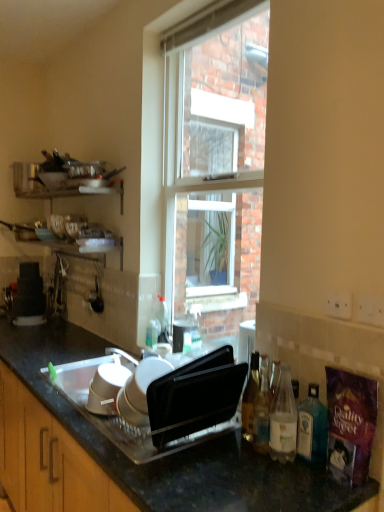
What do you see at coordinates (29, 296) in the screenshot? The height and width of the screenshot is (512, 384). I see `matte black toaster at left, the first appliance viewed from the left` at bounding box center [29, 296].

What is the approximate height of clear glass window at center?

It is 1.61 meters.

The image size is (384, 512). Describe the element at coordinates (283, 420) in the screenshot. I see `translucent glass bottle at lower right, acting as the third bottle starting from the left` at that location.

Identify the location of black granite countertop at center. The image size is (384, 512). (175, 453).

Describe the element at coordinates (262, 413) in the screenshot. I see `translucent glass bottle at lower right, acting as the second bottle starting from the left` at that location.

Looking at this image, how much space does translucent glass bottle at right, marked as the first bottle in a left-to-right arrangement, occupy horizontally?

9.78 centimeters.

What are the coordinates of `matte black toaster at left, which is the 2th appliance in bottom-to-top order` in the screenshot? It's located at (29, 296).

Which is in front, point (107, 382) or point (32, 336)?

The point (107, 382) is closer.

Is white plastic cups at lower left, positioned as the 2th appliance in back-to-front order, surrounding black granite countertop at center?

That's incorrect, black granite countertop at center is not inside white plastic cups at lower left, positioned as the 2th appliance in back-to-front order.

Are white plastic cups at lower left, arranged as the second appliance when viewed from the top, and black granite countertop at center making contact?

No, white plastic cups at lower left, arranged as the second appliance when viewed from the top, is not next to black granite countertop at center.

From a real-world perspective, is white plastic cups at lower left, the first appliance from the front, located beneath black granite countertop at center?

No, from a real-world perspective, white plastic cups at lower left, the first appliance from the front, is not below black granite countertop at center.

Is matte black toaster at left, the 1th appliance positioned from the back, smaller than white plastic cups at lower left, the first appliance from the front?

No.

From the picture: Can you confirm if matte black toaster at left, positioned as the 2th appliance in right-to-left order, is thinner than white plastic cups at lower left, the first appliance from the front?

In fact, matte black toaster at left, positioned as the 2th appliance in right-to-left order, might be wider than white plastic cups at lower left, the first appliance from the front.

Considering the relative sizes of matte black toaster at left, positioned as the 2th appliance in right-to-left order, and white plastic cups at lower left, the 1th appliance in the bottom-to-top sequence, in the image provided, is matte black toaster at left, positioned as the 2th appliance in right-to-left order, taller than white plastic cups at lower left, the 1th appliance in the bottom-to-top sequence,?

Yes, matte black toaster at left, positioned as the 2th appliance in right-to-left order, is taller than white plastic cups at lower left, the 1th appliance in the bottom-to-top sequence.

Is translucent glass bottle at right, positioned as the fourth bottle in right-to-left order, to the left of white plastic cups at lower left, which appears as the first appliance when viewed from the right, from the viewer's perspective?

Incorrect, translucent glass bottle at right, positioned as the fourth bottle in right-to-left order, is not on the left side of white plastic cups at lower left, which appears as the first appliance when viewed from the right.

Is translucent glass bottle at right, marked as the first bottle in a left-to-right arrangement, spatially inside white plastic cups at lower left, positioned as the 2th appliance in back-to-front order, or outside of it?

translucent glass bottle at right, marked as the first bottle in a left-to-right arrangement, exists outside the volume of white plastic cups at lower left, positioned as the 2th appliance in back-to-front order.

Are translucent glass bottle at right, marked as the first bottle in a left-to-right arrangement, and white plastic cups at lower left, the 1th appliance in the bottom-to-top sequence, far apart?

translucent glass bottle at right, marked as the first bottle in a left-to-right arrangement, is near white plastic cups at lower left, the 1th appliance in the bottom-to-top sequence, not far away.

How many degrees apart are the facing directions of translucent glass bottle at right, positioned as the fourth bottle in right-to-left order, and white plastic cups at lower left, arranged as the second appliance when viewed from the top?

There is a 5.94-degree angle between the facing directions of translucent glass bottle at right, positioned as the fourth bottle in right-to-left order, and white plastic cups at lower left, arranged as the second appliance when viewed from the top.

From a real-world perspective, is white plastic cups at lower left, positioned as the 2th appliance in back-to-front order, on translucent glass bottle at lower right, positioned as the 2th bottle in right-to-left order?

Actually, white plastic cups at lower left, positioned as the 2th appliance in back-to-front order, is physically below translucent glass bottle at lower right, positioned as the 2th bottle in right-to-left order, in the real world.

Are white plastic cups at lower left, the 2th appliance in the left-to-right sequence, and translucent glass bottle at lower right, acting as the third bottle starting from the left, far apart?

No, there isn't a large distance between white plastic cups at lower left, the 2th appliance in the left-to-right sequence, and translucent glass bottle at lower right, acting as the third bottle starting from the left.

From the image's perspective, is white plastic cups at lower left, positioned as the 2th appliance in back-to-front order, located above or below translucent glass bottle at lower right, positioned as the 2th bottle in right-to-left order?

white plastic cups at lower left, positioned as the 2th appliance in back-to-front order, is situated lower than translucent glass bottle at lower right, positioned as the 2th bottle in right-to-left order, in the image.

Could you tell me if white plastic cups at lower left, the 2th appliance in the left-to-right sequence, is facing translucent glass bottle at lower right, acting as the third bottle starting from the left?

No, white plastic cups at lower left, the 2th appliance in the left-to-right sequence, is not turned towards translucent glass bottle at lower right, acting as the third bottle starting from the left.

At what (x,y) coordinates should I click in order to perform the action: click on the 2nd bottle above when counting from the translucent glass bottle at lower right, which is counted as the 3th bottle, starting from the right (from the image's perspective). Please return your answer as a coordinate pair (x, y). The height and width of the screenshot is (512, 384). Looking at the image, I should click on (250, 398).

How distant is translucent glass bottle at right, positioned as the fourth bottle in right-to-left order, from translucent glass bottle at lower right, acting as the second bottle starting from the left?

They are 4.17 centimeters apart.

Looking at this image, between translucent glass bottle at right, marked as the first bottle in a left-to-right arrangement, and translucent glass bottle at lower right, acting as the second bottle starting from the left, which one has smaller width?

With smaller width is translucent glass bottle at lower right, acting as the second bottle starting from the left.

Is translucent glass bottle at right, positioned as the fourth bottle in right-to-left order, smaller than translucent glass bottle at lower right, acting as the second bottle starting from the left?

No, translucent glass bottle at right, positioned as the fourth bottle in right-to-left order, is not smaller than translucent glass bottle at lower right, acting as the second bottle starting from the left.

Consider the image. Can you confirm if matte black toaster at left, the 1th appliance positioned from the back, is smaller than black granite countertop at center?

Indeed, matte black toaster at left, the 1th appliance positioned from the back, has a smaller size compared to black granite countertop at center.

Is matte black toaster at left, the first appliance viewed from the left, surrounding black granite countertop at center?

No, matte black toaster at left, the first appliance viewed from the left, does not contain black granite countertop at center.

Does point (21, 276) come closer to viewer compared to point (120, 485)?

That is False.

At what (x,y) coordinates should I click in order to perform the action: click on countertop below the matte black toaster at left, positioned as the 2th appliance in right-to-left order (from the image's perspective). Please return your answer as a coordinate pair (x, y). This screenshot has width=384, height=512. Looking at the image, I should click on (175, 453).

From a real-world perspective, is translucent glass bottle at right, marked as the first bottle in a left-to-right arrangement, above or below translucent glass bottle at right, the 4th bottle positioned from the left?

From a real-world perspective, translucent glass bottle at right, marked as the first bottle in a left-to-right arrangement, is physically above translucent glass bottle at right, the 4th bottle positioned from the left.

Is translucent glass bottle at right, the 4th bottle positioned from the left, located within translucent glass bottle at right, marked as the first bottle in a left-to-right arrangement?

No, translucent glass bottle at right, the 4th bottle positioned from the left, is located outside of translucent glass bottle at right, marked as the first bottle in a left-to-right arrangement.

Is translucent glass bottle at right, marked as the first bottle in a left-to-right arrangement, at the right side of translucent glass bottle at right, the 4th bottle positioned from the left?

No.

Image resolution: width=384 pixels, height=512 pixels. What are the coordinates of `the 1st appliance above the black granite countertop at center (from a real-world perspective)` in the screenshot? It's located at (106, 388).

Image resolution: width=384 pixels, height=512 pixels. I want to click on appliance that appears behind the white plastic cups at lower left, positioned as the 2th appliance in back-to-front order, so tap(29, 296).

Based on their spatial positions, is clear glass window at center or matte black toaster at left, the 1th appliance positioned from the back, further from translucent glass bottle at lower right, acting as the second bottle starting from the left?

clear glass window at center lies further to translucent glass bottle at lower right, acting as the second bottle starting from the left, than the other object.

Based on their spatial positions, is translucent glass bottle at lower right, acting as the third bottle starting from the left, or translucent glass bottle at lower right, acting as the second bottle starting from the left, closer to white plastic cups at lower left, positioned as the 2th appliance in back-to-front order?

Based on the image, translucent glass bottle at lower right, acting as the second bottle starting from the left, appears to be nearer to white plastic cups at lower left, positioned as the 2th appliance in back-to-front order.

Based on their spatial positions, is clear glass window at center or translucent glass bottle at lower right, acting as the third bottle starting from the left, closer to white plastic cups at lower left, arranged as the second appliance when viewed from the top?

The object closer to white plastic cups at lower left, arranged as the second appliance when viewed from the top, is translucent glass bottle at lower right, acting as the third bottle starting from the left.

Looking at the image, which one is located closer to translucent glass bottle at right, positioned as the fourth bottle in right-to-left order, matte black toaster at left, positioned as the 2th appliance in right-to-left order, or black granite countertop at center?

Based on the image, black granite countertop at center appears to be nearer to translucent glass bottle at right, positioned as the fourth bottle in right-to-left order.

Estimate the real-world distances between objects in this image. Which object is closer to black granite countertop at center, white plastic cups at lower left, the first appliance from the front, or matte black toaster at left, the 2th appliance from the front?

white plastic cups at lower left, the first appliance from the front, is closer to black granite countertop at center.

Looking at the image, which one is located further to clear glass window at center, translucent glass bottle at lower right, positioned as the 2th bottle in right-to-left order, or translucent glass bottle at right, positioned as the fourth bottle in right-to-left order?

translucent glass bottle at lower right, positioned as the 2th bottle in right-to-left order, is positioned further to the anchor clear glass window at center.

Estimate the real-world distances between objects in this image. Which object is closer to clear glass window at center, matte black toaster at left, which is the 2th appliance in bottom-to-top order, or translucent glass bottle at right, positioned as the fourth bottle in right-to-left order?

The object closer to clear glass window at center is matte black toaster at left, which is the 2th appliance in bottom-to-top order.

Looking at the image, which one is located closer to matte black toaster at left, the 2th appliance from the front, translucent glass bottle at right, positioned as the fourth bottle in right-to-left order, or translucent glass bottle at right, the 4th bottle positioned from the left?

translucent glass bottle at right, positioned as the fourth bottle in right-to-left order, is positioned closer to the anchor matte black toaster at left, the 2th appliance from the front.

The image size is (384, 512). Find the location of `appliance between translucent glass bottle at lower right, which is counted as the 3th bottle, starting from the right, and matte black toaster at left, positioned as the 1th appliance in top-to-bottom order, from front to back`. appliance between translucent glass bottle at lower right, which is counted as the 3th bottle, starting from the right, and matte black toaster at left, positioned as the 1th appliance in top-to-bottom order, from front to back is located at coordinates (106, 388).

Identify the location of bottle between clear glass window at center and translucent glass bottle at lower right, acting as the third bottle starting from the left, in the up-down direction. click(250, 398).

Find the location of a particular element. window between white plastic cups at lower left, arranged as the second appliance when viewed from the top, and matte black toaster at left, the 1th appliance positioned from the back, along the z-axis is located at coordinates (214, 166).

Where is `bottle between translucent glass bottle at lower right, acting as the second bottle starting from the left, and matte black toaster at left, the first appliance viewed from the left, from front to back`? bottle between translucent glass bottle at lower right, acting as the second bottle starting from the left, and matte black toaster at left, the first appliance viewed from the left, from front to back is located at coordinates (250, 398).